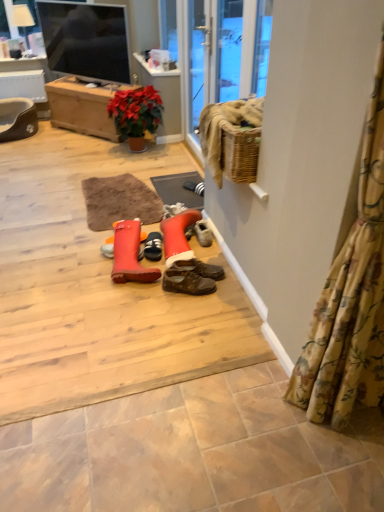
What is the approximate height of white fabric lampshade at upper left?

white fabric lampshade at upper left is 18.47 inches tall.

In the scene shown: What is the approximate height of rubberized orange boot at center, which is the 1th footwear from left to right?

rubberized orange boot at center, which is the 1th footwear from left to right, is 8.41 inches in height.

Where is `matte beige tile at lower center`? matte beige tile at lower center is located at coordinates (194, 453).

Consider the image. Is the surface of white fabric lampshade at upper left in direct contact with floral fabric curtain at right?

No, white fabric lampshade at upper left is not next to floral fabric curtain at right.

From the image's perspective, which one is positioned lower, white fabric lampshade at upper left or floral fabric curtain at right?

floral fabric curtain at right is shown below in the image.

How much distance is there between white fabric lampshade at upper left and floral fabric curtain at right?

white fabric lampshade at upper left and floral fabric curtain at right are 4.30 meters apart.

From a real-world perspective, which is physically below, white fabric lampshade at upper left or floral fabric curtain at right?

floral fabric curtain at right.

Considering the sizes of objects black suede shoe at center, which ranks as the second footwear in left-to-right order, and flat screen tv at upper left in the image provided, who is thinner, black suede shoe at center, which ranks as the second footwear in left-to-right order, or flat screen tv at upper left?

black suede shoe at center, which ranks as the second footwear in left-to-right order, is thinner.

Are black suede shoe at center, which ranks as the second footwear in left-to-right order, and flat screen tv at upper left far apart?

black suede shoe at center, which ranks as the second footwear in left-to-right order, is positioned a significant distance from flat screen tv at upper left.

Which is less distant, (158, 238) or (57, 22)?

Clearly, point (158, 238) is closer to the camera than point (57, 22).

Is black suede shoe at center, the second footwear when ordered from right to left, looking in the opposite direction of flat screen tv at upper left?

That's not correct — black suede shoe at center, the second footwear when ordered from right to left, is not looking away from flat screen tv at upper left.

In the scene shown: Is matte beige tile at lower center looking in the opposite direction of flat screen tv at upper left?

matte beige tile at lower center does not have its back to flat screen tv at upper left.

Who is bigger, matte beige tile at lower center or flat screen tv at upper left?

flat screen tv at upper left is bigger.

Is point (71, 509) positioned in front of point (79, 42)?

Yes, it is in front of point (79, 42).

Would you say matte beige tile at lower center is outside flat screen tv at upper left?

Yes, matte beige tile at lower center is located beyond the bounds of flat screen tv at upper left.

Based on the photo, does white fabric lampshade at upper left lie in front of brown leather shoes at center, the 1th footwear from the right?

No, white fabric lampshade at upper left is behind brown leather shoes at center, the 1th footwear from the right.

How many degrees apart are the facing directions of white fabric lampshade at upper left and brown leather shoes at center, the third footwear from the left?

108 degrees.

Where is `lamp above the brown leather shoes at center, the third footwear from the left (from a real-world perspective)`? Image resolution: width=384 pixels, height=512 pixels. lamp above the brown leather shoes at center, the third footwear from the left (from a real-world perspective) is located at coordinates (22, 19).

Which of these two, white fabric lampshade at upper left or brown leather shoes at center, the third footwear from the left, is thinner?

white fabric lampshade at upper left is thinner.

From the image's perspective, who appears lower, black suede shoe at center, which ranks as the second footwear in left-to-right order, or matte beige tile at lower center?

matte beige tile at lower center appears lower in the image.

From a real-world perspective, is black suede shoe at center, which ranks as the second footwear in left-to-right order, over matte beige tile at lower center?

Yes, from a real-world perspective, black suede shoe at center, which ranks as the second footwear in left-to-right order, is on top of matte beige tile at lower center.

Considering the relative sizes of black suede shoe at center, which ranks as the second footwear in left-to-right order, and matte beige tile at lower center in the image provided, is black suede shoe at center, which ranks as the second footwear in left-to-right order, shorter than matte beige tile at lower center?

Incorrect, the height of black suede shoe at center, which ranks as the second footwear in left-to-right order, does not fall short of that of matte beige tile at lower center.

Is black suede shoe at center, which ranks as the second footwear in left-to-right order, oriented towards matte beige tile at lower center?

No, black suede shoe at center, which ranks as the second footwear in left-to-right order, is not facing towards matte beige tile at lower center.

Considering the relative sizes of flat screen tv at upper left and floral fabric curtain at right in the image provided, is flat screen tv at upper left wider than floral fabric curtain at right?

In fact, flat screen tv at upper left might be narrower than floral fabric curtain at right.

Between flat screen tv at upper left and floral fabric curtain at right, which one has larger size?

flat screen tv at upper left is bigger.

How different are the orientations of flat screen tv at upper left and floral fabric curtain at right in degrees?

They differ by 41.9 degrees in their facing directions.

In order to click on curtain below the flat screen tv at upper left (from a real-world perspective) in this screenshot , I will do `click(351, 298)`.

Considering the relative positions of black suede shoe at center, the second footwear when ordered from right to left, and brown leather shoes at center, the third footwear from the left, in the image provided, is black suede shoe at center, the second footwear when ordered from right to left, to the right of brown leather shoes at center, the third footwear from the left, from the viewer's perspective?

Incorrect, black suede shoe at center, the second footwear when ordered from right to left, is not on the right side of brown leather shoes at center, the third footwear from the left.

Does black suede shoe at center, the second footwear when ordered from right to left, have a greater height compared to brown leather shoes at center, the 1th footwear from the right?

In fact, black suede shoe at center, the second footwear when ordered from right to left, may be shorter than brown leather shoes at center, the 1th footwear from the right.

Considering the relative sizes of black suede shoe at center, which ranks as the second footwear in left-to-right order, and brown leather shoes at center, the third footwear from the left, in the image provided, is black suede shoe at center, which ranks as the second footwear in left-to-right order, smaller than brown leather shoes at center, the third footwear from the left,?

Indeed, black suede shoe at center, which ranks as the second footwear in left-to-right order, has a smaller size compared to brown leather shoes at center, the third footwear from the left.

Which is more distant, (157, 242) or (175, 265)?

The point (157, 242) is farther from the camera.

The width and height of the screenshot is (384, 512). What are the coordinates of `curtain in front of the white fabric lampshade at upper left` in the screenshot? It's located at (351, 298).

At what (x,y) coordinates should I click in order to perform the action: click on the 2nd footwear to the right when counting from the flat screen tv at upper left. Please return your answer as a coordinate pair (x, y). Looking at the image, I should click on (153, 247).

Based on their spatial positions, is rubberized orange boot at center, which ranks as the third footwear in right-to-left order, or black suede shoe at center, which ranks as the second footwear in left-to-right order, further from matte beige tile at lower center?

black suede shoe at center, which ranks as the second footwear in left-to-right order.

Looking at the image, which one is located closer to matte beige tile at lower center, rubberized orange boot at center, which is the 1th footwear from left to right, or floral fabric curtain at right?

The object closer to matte beige tile at lower center is floral fabric curtain at right.

When comparing their distances from rubberized orange boot at center, which ranks as the third footwear in right-to-left order, does black rubber doormat at center or white fabric lampshade at upper left seem closer?

black rubber doormat at center lies closer to rubberized orange boot at center, which ranks as the third footwear in right-to-left order, than the other object.

From the image, which object appears to be farther from black suede shoe at center, the second footwear when ordered from right to left, floral fabric curtain at right or flat screen tv at upper left?

Based on the image, flat screen tv at upper left appears to be further to black suede shoe at center, the second footwear when ordered from right to left.

Which object lies nearer to the anchor point floral fabric curtain at right, brown leather shoes at center, the third footwear from the left, or black rubber doormat at center?

brown leather shoes at center, the third footwear from the left.

Consider the image. When comparing their distances from black suede shoe at center, the second footwear when ordered from right to left, does floral fabric curtain at right or rubberized orange boot at center, which ranks as the third footwear in right-to-left order, seem further?

Among the two, floral fabric curtain at right is located further to black suede shoe at center, the second footwear when ordered from right to left.

Which object lies further to the anchor point white fabric lampshade at upper left, rubberized orange boot at center, which ranks as the third footwear in right-to-left order, or floral fabric curtain at right?

The object further to white fabric lampshade at upper left is floral fabric curtain at right.

Based on the photo, considering their positions, is matte beige tile at lower center positioned closer to black suede shoe at center, which ranks as the second footwear in left-to-right order, than brown leather shoes at center, the 1th footwear from the right?

Among the two, brown leather shoes at center, the 1th footwear from the right, is located nearer to black suede shoe at center, which ranks as the second footwear in left-to-right order.

Identify the location of tile located between floral fabric curtain at right and white fabric lampshade at upper left in the depth direction. (194, 453).

The height and width of the screenshot is (512, 384). In order to click on doormat between flat screen tv at upper left and rubberized orange boot at center, which is the 1th footwear from left to right, in the vertical direction in this screenshot , I will do `click(178, 189)`.

The width and height of the screenshot is (384, 512). Find the location of `doormat between white fabric lampshade at upper left and matte beige tile at lower center from top to bottom`. doormat between white fabric lampshade at upper left and matte beige tile at lower center from top to bottom is located at coordinates (178, 189).

I want to click on doormat between floral fabric curtain at right and white fabric lampshade at upper left in the front-back direction, so click(178, 189).